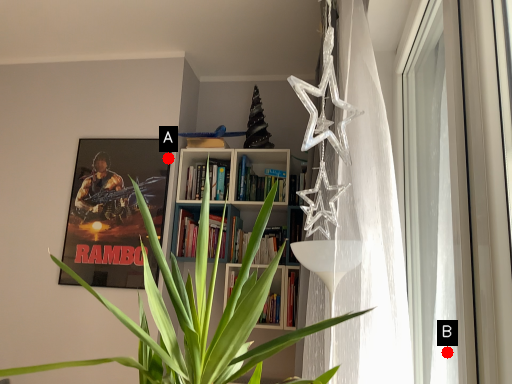
Question: Two points are circled on the image, labeled by A and B beside each circle. Which point is closer to the camera?

Choices:
 (A) A is closer
 (B) B is closer

Answer: (B)